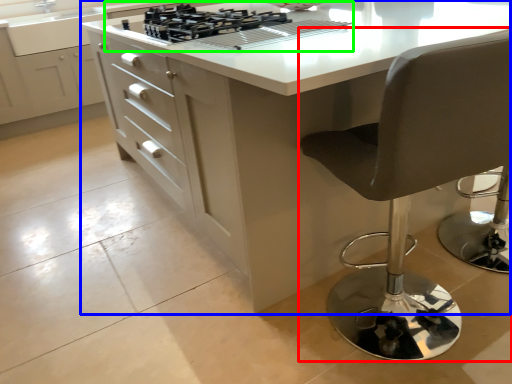
Question: Based on their relative distances, which object is farther from chair (highlighted by a red box)? Choose from table (highlighted by a blue box) and gas stove (highlighted by a green box).

Choices:
 (A) table
 (B) gas stove

Answer: (B)